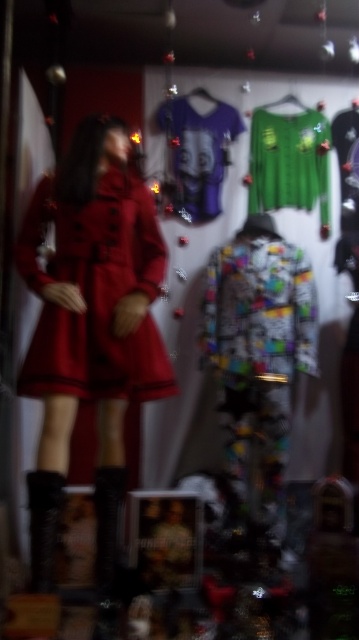
You are a customer in a store and you see the green matte sweater at upper center and the purple jersey at center. Which one is thinner?

The green matte sweater at upper center is thinner than the purple jersey at center.

You are a customer in the store and want to touch both the matte red coat at center and the purple jersey at center. Which one can you reach first without moving closer?

The matte red coat at center is closer to the viewer than the purple jersey at center, so you can reach it first without moving closer.

You are a customer trying to decide between the matte red coat at center and the purple jersey at center. Based on the display, which one takes up more horizontal space when laid out flat?

The matte red coat at center is wider than the purple jersey at center, so it takes up more horizontal space when laid out flat.